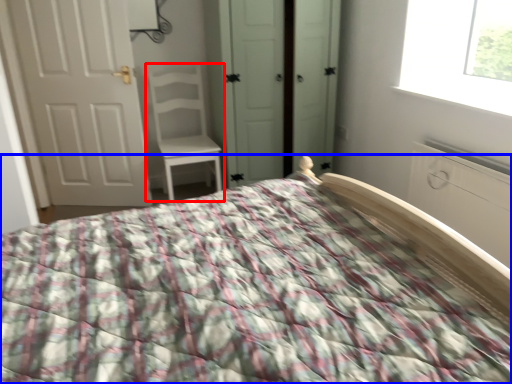
Question: Which object is closer to the camera taking this photo, chair (highlighted by a red box) or bed (highlighted by a blue box)?

Choices:
 (A) chair
 (B) bed

Answer: (B)